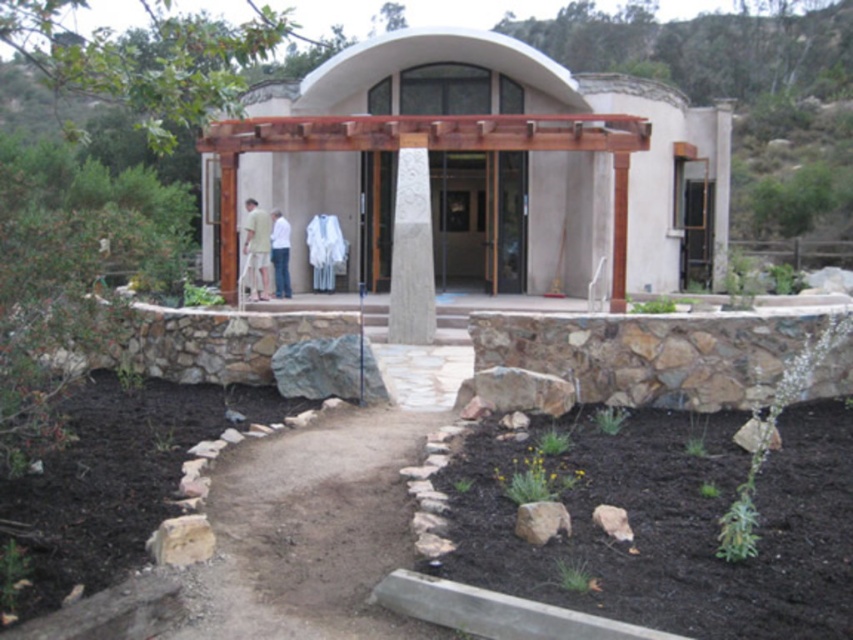
You are a contractor assessing the building for maintenance. You need to determine if a ladder you have, which is 2 meters tall, will be sufficient to reach the top of the wooden pergola at center and the gray rough rock at lower left. Based on their heights, which object can the ladder reach?

The wooden pergola at center has a greater height than the gray rough rock at lower left. Since the ladder is 2 meters tall, it can reach the top of the gray rough rock at lower left but may not be sufficient to reach the top of the wooden pergola at center unless the pergola is shorter than 2 meters. However, since the pergola is taller than the rock, if the rock requires less than 2 meters, the ladder can reach it, but the pergola might need a taller ladder.

You are planning to install a new lighting system for the wooden pergola at center and the light green fabric at center. Since you want to ensure proper coverage, which object requires a larger lighting setup based on their sizes?

The wooden pergola at center requires a larger lighting setup because it is larger in size than the light green fabric at center.

You are standing in front of the building and want to take a photo. You notice two points marked in the scene. The first point is at coordinate point (637, 160) and the second is at point (187, 524). Which point will appear closer to the camera in your photo?

Point (187, 524) will appear closer to the camera in the photo because it is physically closer to the camera than point (637, 160), which is further away.